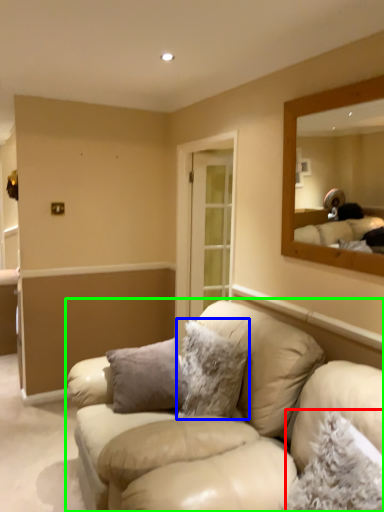
Question: Which object is the farthest from pillow (highlighted by a red box)? Choose among these: pillow (highlighted by a blue box) or studio couch (highlighted by a green box).

Choices:
 (A) pillow
 (B) studio couch

Answer: (A)